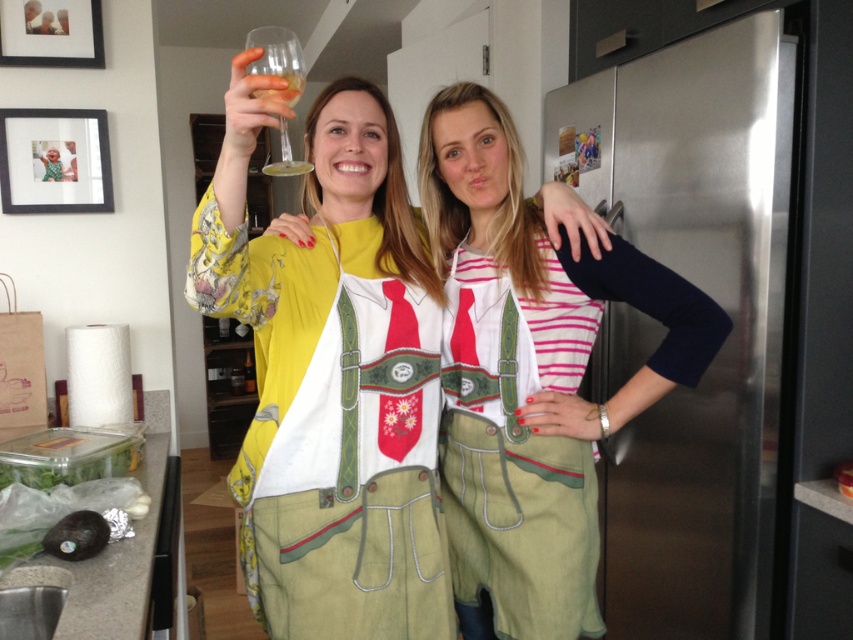
Question: Does green fabric apron at center appear under clear glass wine glass at upper left?

Choices:
 (A) no
 (B) yes

Answer: (B)

Question: Which object is the farthest from the clear glass wine glass at upper left?

Choices:
 (A) green cotton apron at center
 (B) matte yellow blouse at center
 (C) translucent glass at upper center
 (D) green fabric apron at center

Answer: (D)

Question: Which object appears farthest from the camera in this image?

Choices:
 (A) clear glass wine glass at upper left
 (B) translucent glass at upper center

Answer: (B)

Question: Among these objects, which one is farthest from the camera?

Choices:
 (A) clear glass wine glass at upper left
 (B) translucent glass at upper center

Answer: (B)

Question: Is matte yellow blouse at center bigger than translucent glass at upper center?

Choices:
 (A) no
 (B) yes

Answer: (B)

Question: Considering the relative positions of green cotton apron at center and clear glass wine glass at upper left in the image provided, where is green cotton apron at center located with respect to clear glass wine glass at upper left?

Choices:
 (A) left
 (B) right

Answer: (B)